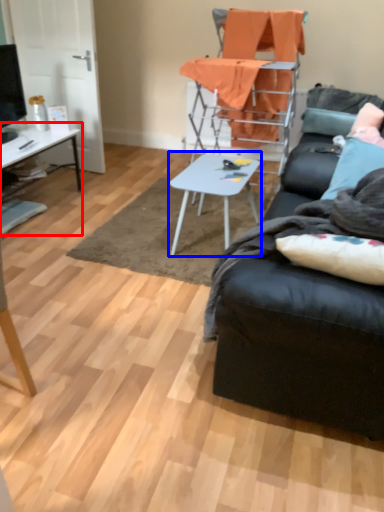
Question: Among these objects, which one is nearest to the camera, desk (highlighted by a red box) or table (highlighted by a blue box)?

Choices:
 (A) desk
 (B) table

Answer: (B)